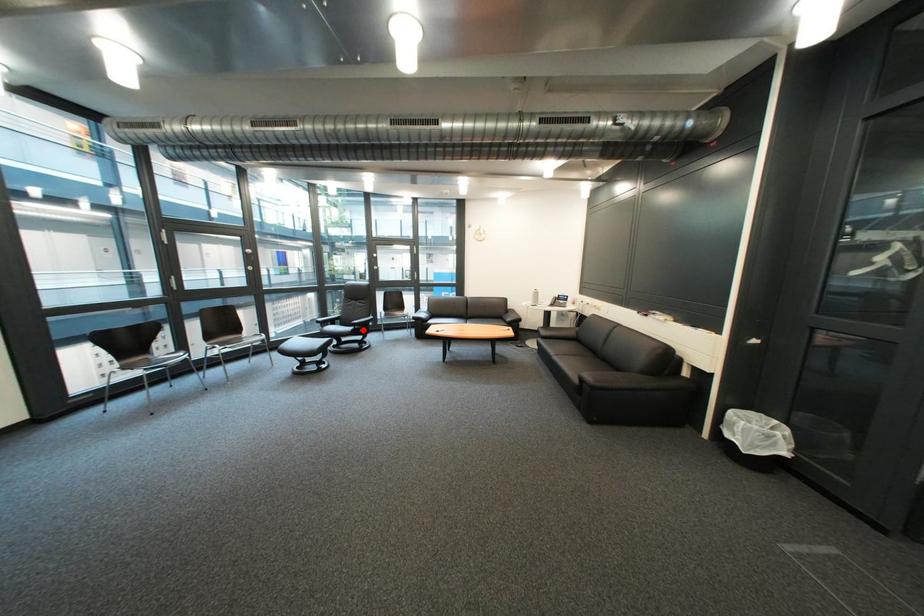
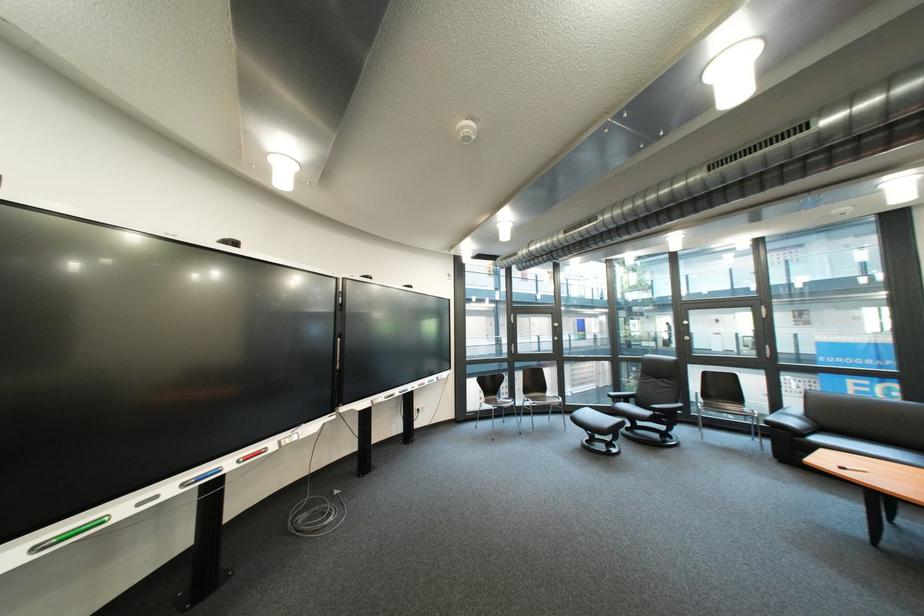
Question: I am providing you with two images of the same scene from different viewpoints. Given a red point in image1, look at the same physical point in image2. Is it:

Choices:
 (A) Closer to the viewpoint
 (B) Farther from the viewpoint

Answer: (B)